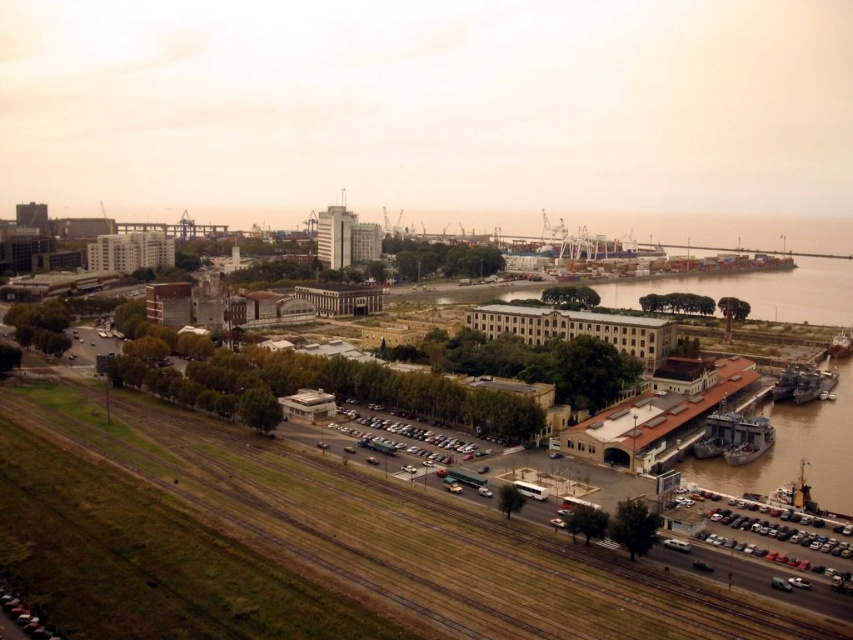
Does brown grassy train track at lower left have a greater width compared to metallic gray ship at lower right?

Correct, the width of brown grassy train track at lower left exceeds that of metallic gray ship at lower right.

Can you confirm if brown grassy train track at lower left is thinner than metallic gray ship at lower right?

No, brown grassy train track at lower left is not thinner than metallic gray ship at lower right.

Between point (421, 497) and point (744, 435), which one is positioned in front?

Point (421, 497) is in front.

This screenshot has width=853, height=640. What are the coordinates of `brown grassy train track at lower left` in the screenshot? It's located at (404, 534).

Is point (57, 432) in front of point (798, 372)?

Yes, point (57, 432) is closer to viewer.

Is brown grassy train track at lower left above shiny metallic ship at lower right?

Incorrect, brown grassy train track at lower left is not positioned above shiny metallic ship at lower right.

Image resolution: width=853 pixels, height=640 pixels. What do you see at coordinates (404, 534) in the screenshot?
I see `brown grassy train track at lower left` at bounding box center [404, 534].

Where is `brown grassy train track at lower left`? The height and width of the screenshot is (640, 853). brown grassy train track at lower left is located at coordinates (404, 534).

Between shiny metallic ship at lower right and metallic silver boat at right, which one has more height?

Standing taller between the two is metallic silver boat at right.

Does point (779, 394) lie in front of point (846, 344)?

Yes, it is in front of point (846, 344).

Does point (834, 378) come closer to viewer compared to point (828, 344)?

Yes, point (834, 378) is closer to viewer.

At what (x,y) coordinates should I click in order to perform the action: click on shiny metallic ship at lower right. Please return your answer as a coordinate pair (x, y). Looking at the image, I should click on (802, 385).